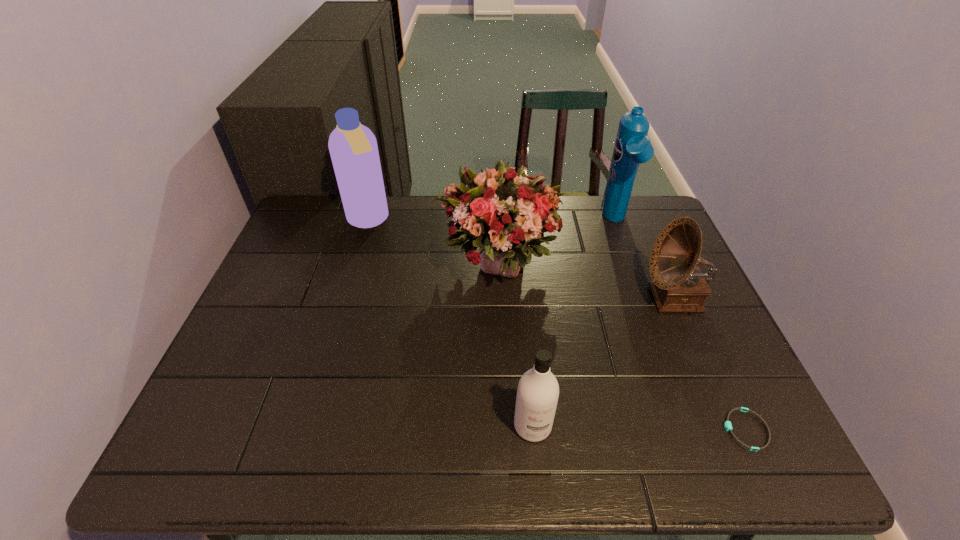
Find the location of a particular element. This screenshot has height=540, width=960. phonograph record at the right edge is located at coordinates (678, 286).

Locate an element on the screen. The height and width of the screenshot is (540, 960). wristband situated at the right edge is located at coordinates (727, 425).

In order to click on object that is at the far right corner in this screenshot , I will do `click(632, 147)`.

Find the location of a particular element. This screenshot has height=540, width=960. object present at the near right corner is located at coordinates (727, 425).

Identify the location of vacant space at the far edge of the desktop. This screenshot has width=960, height=540. (601, 196).

In the image, there is a desktop. What are the coordinates of `free space at the near edge` in the screenshot? It's located at [570, 433].

Locate an element on the screen. The width and height of the screenshot is (960, 540). free space at the left edge of the desktop is located at coordinates (228, 396).

In the image, there is a desktop. Identify the location of vacant space at the right edge. This screenshot has width=960, height=540. (732, 371).

At what (x,y) coordinates should I click in order to perform the action: click on free space at the far left corner of the desktop. Please return your answer as a coordinate pair (x, y). The image size is (960, 540). Looking at the image, I should click on (331, 213).

Find the location of a particular element. free space at the near left corner of the desktop is located at coordinates (260, 429).